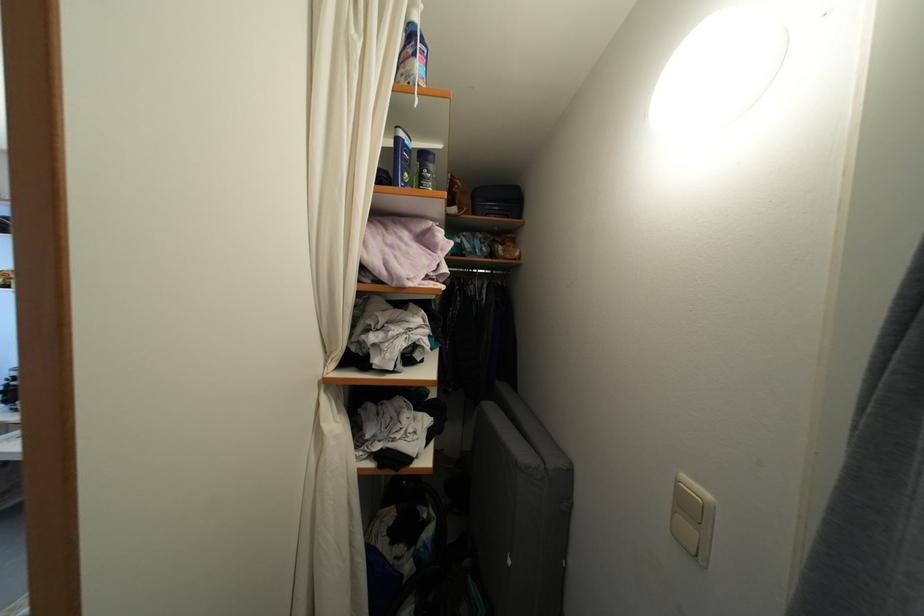
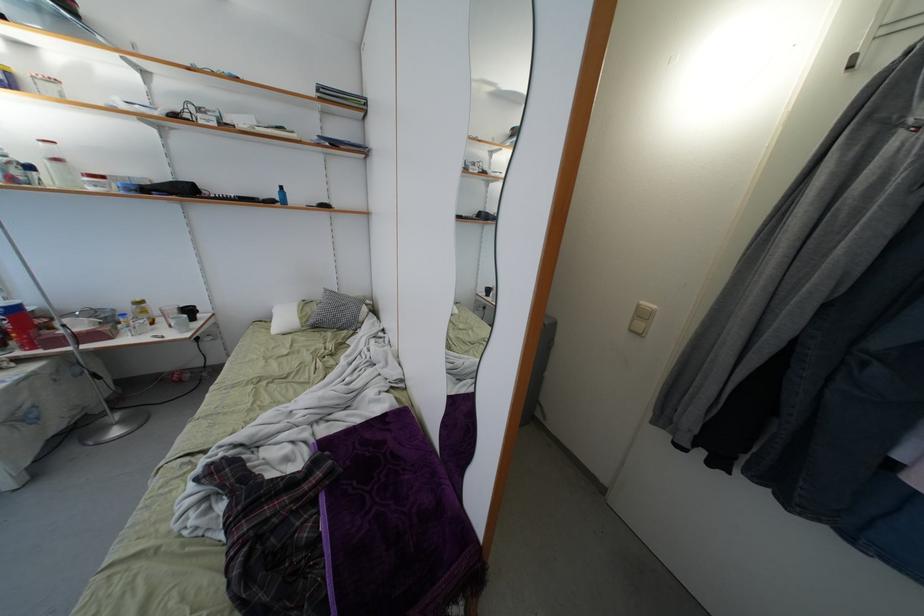
How did the camera likely rotate?

The camera rotated toward right-down.